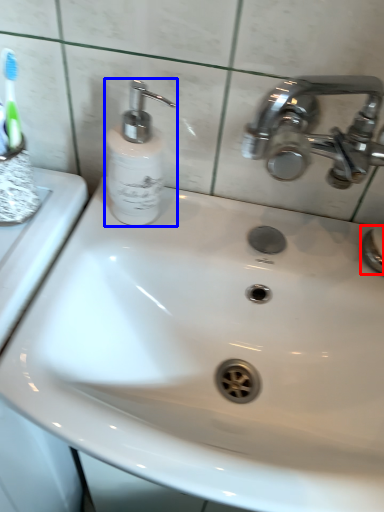
Question: Which object appears closest to the camera in this image, plumbing fixture (highlighted by a red box) or soap dispenser (highlighted by a blue box)?

Choices:
 (A) plumbing fixture
 (B) soap dispenser

Answer: (B)